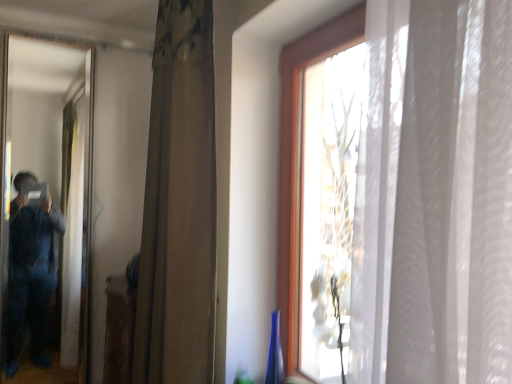
Question: Should I look upward or downward to see brown textured curtain at center?

Choices:
 (A) down
 (B) up

Answer: (B)

Question: Can you confirm if brown textured curtain at center is positioned to the right of matte black mirror at left?

Choices:
 (A) yes
 (B) no

Answer: (A)

Question: From the image's perspective, is brown textured curtain at center located beneath matte black mirror at left?

Choices:
 (A) no
 (B) yes

Answer: (A)

Question: Does brown textured curtain at center have a larger size compared to matte black mirror at left?

Choices:
 (A) no
 (B) yes

Answer: (B)

Question: Does brown textured curtain at center have a lesser width compared to matte black mirror at left?

Choices:
 (A) yes
 (B) no

Answer: (B)

Question: Can we say brown textured curtain at center lies outside matte black mirror at left?

Choices:
 (A) no
 (B) yes

Answer: (B)

Question: Is brown textured curtain at center further to camera compared to matte black mirror at left?

Choices:
 (A) yes
 (B) no

Answer: (B)

Question: From the image's perspective, is matte black mirror at left above brown textured curtain at center?

Choices:
 (A) no
 (B) yes

Answer: (A)

Question: Is brown textured curtain at center surrounded by matte black mirror at left?

Choices:
 (A) no
 (B) yes

Answer: (A)

Question: From a real-world perspective, is matte black mirror at left on brown textured curtain at center?

Choices:
 (A) yes
 (B) no

Answer: (B)

Question: From a real-world perspective, is matte black mirror at left physically below brown textured curtain at center?

Choices:
 (A) yes
 (B) no

Answer: (A)

Question: Is matte black mirror at left turned away from brown textured curtain at center?

Choices:
 (A) yes
 (B) no

Answer: (B)

Question: Is matte black mirror at left facing towards brown textured curtain at center?

Choices:
 (A) no
 (B) yes

Answer: (A)

Question: Based on their positions, is matte black mirror at left located to the left or right of brown textured curtain at center?

Choices:
 (A) right
 (B) left

Answer: (B)